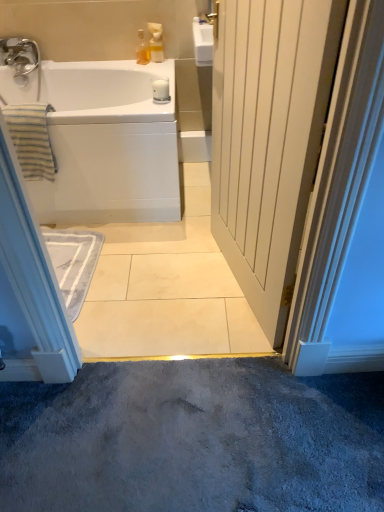
Question: Is white glossy bathtub at upper left in front of translucent glass bottle at upper center, marked as the second toiletry in a right-to-left arrangement?

Choices:
 (A) yes
 (B) no

Answer: (A)

Question: Is white glossy bathtub at upper left shorter than translucent glass bottle at upper center, marked as the second toiletry in a right-to-left arrangement?

Choices:
 (A) no
 (B) yes

Answer: (A)

Question: Does white glossy bathtub at upper left have a greater height compared to translucent glass bottle at upper center, marked as the second toiletry in a right-to-left arrangement?

Choices:
 (A) no
 (B) yes

Answer: (B)

Question: From a real-world perspective, does white glossy bathtub at upper left sit lower than translucent glass bottle at upper center, marked as the second toiletry in a right-to-left arrangement?

Choices:
 (A) no
 (B) yes

Answer: (B)

Question: Considering the relative sizes of white glossy bathtub at upper left and translucent glass bottle at upper center, marked as the second toiletry in a right-to-left arrangement, in the image provided, is white glossy bathtub at upper left thinner than translucent glass bottle at upper center, marked as the second toiletry in a right-to-left arrangement,?

Choices:
 (A) no
 (B) yes

Answer: (A)

Question: Is white glossy bathtub at upper left placed right next to translucent glass bottle at upper center, placed as the first toiletry when sorted from left to right?

Choices:
 (A) yes
 (B) no

Answer: (B)

Question: Does striped cotton towel at left contain white wood door at center?

Choices:
 (A) yes
 (B) no

Answer: (B)

Question: Considering the relative sizes of striped cotton towel at left and white wood door at center in the image provided, is striped cotton towel at left smaller than white wood door at center?

Choices:
 (A) no
 (B) yes

Answer: (B)

Question: Considering the relative positions of striped cotton towel at left and white wood door at center in the image provided, is striped cotton towel at left to the right of white wood door at center from the viewer's perspective?

Choices:
 (A) no
 (B) yes

Answer: (A)

Question: Can you confirm if striped cotton towel at left is positioned to the left of white wood door at center?

Choices:
 (A) yes
 (B) no

Answer: (A)

Question: Can you confirm if striped cotton towel at left is shorter than white wood door at center?

Choices:
 (A) no
 (B) yes

Answer: (B)

Question: Is striped cotton towel at left in contact with white wood door at center?

Choices:
 (A) yes
 (B) no

Answer: (B)

Question: Is translucent glass bottle at upper center, placed as the first toiletry when sorted from left to right, at the back of white wood door at center?

Choices:
 (A) yes
 (B) no

Answer: (B)